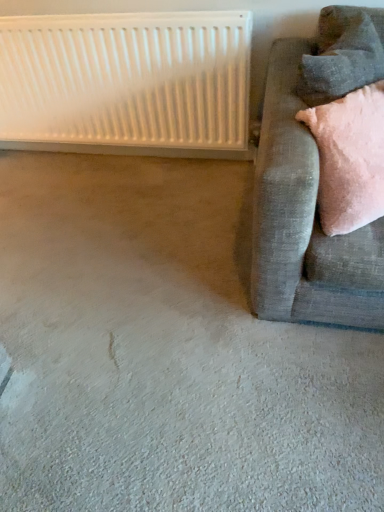
Question: Does velvet gray pillow at upper right turn towards velvet grey couch at right?

Choices:
 (A) yes
 (B) no

Answer: (A)

Question: Is velvet gray pillow at upper right not close to velvet grey couch at right?

Choices:
 (A) yes
 (B) no

Answer: (B)

Question: Is velvet gray pillow at upper right located outside velvet grey couch at right?

Choices:
 (A) yes
 (B) no

Answer: (B)

Question: From a real-world perspective, is velvet gray pillow at upper right positioned over velvet grey couch at right based on gravity?

Choices:
 (A) yes
 (B) no

Answer: (A)

Question: Is velvet gray pillow at upper right thinner than velvet grey couch at right?

Choices:
 (A) no
 (B) yes

Answer: (B)

Question: In terms of width, does velvet grey couch at right look wider or thinner when compared to white plastic radiator at upper left?

Choices:
 (A) wide
 (B) thin

Answer: (A)

Question: Is velvet grey couch at right in front of or behind white plastic radiator at upper left in the image?

Choices:
 (A) behind
 (B) front

Answer: (B)

Question: From the image's perspective, is velvet grey couch at right positioned above or below white plastic radiator at upper left?

Choices:
 (A) above
 (B) below

Answer: (B)

Question: From their relative heights in the image, would you say velvet grey couch at right is taller or shorter than white plastic radiator at upper left?

Choices:
 (A) short
 (B) tall

Answer: (B)

Question: In terms of height, does velvet gray pillow at upper right look taller or shorter compared to velvet grey couch at right?

Choices:
 (A) short
 (B) tall

Answer: (A)

Question: From the image's perspective, relative to velvet grey couch at right, is velvet gray pillow at upper right above or below?

Choices:
 (A) above
 (B) below

Answer: (A)

Question: Is velvet gray pillow at upper right wider or thinner than velvet grey couch at right?

Choices:
 (A) wide
 (B) thin

Answer: (B)

Question: Considering the positions of point (380, 46) and point (375, 290), is point (380, 46) closer or farther from the camera than point (375, 290)?

Choices:
 (A) closer
 (B) farther

Answer: (B)

Question: Considering the positions of white plastic radiator at upper left and velvet grey couch at right in the image, is white plastic radiator at upper left bigger or smaller than velvet grey couch at right?

Choices:
 (A) big
 (B) small

Answer: (B)

Question: Considering the positions of white plastic radiator at upper left and velvet grey couch at right in the image, is white plastic radiator at upper left taller or shorter than velvet grey couch at right?

Choices:
 (A) tall
 (B) short

Answer: (B)